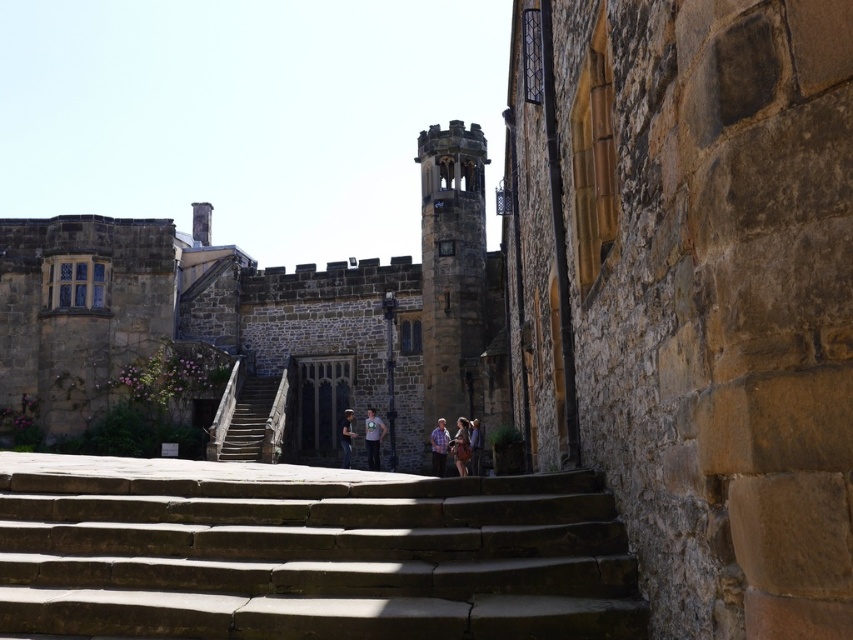
Question: Does brown stone tower at center appear on the right side of blue plaid shirt at center?

Choices:
 (A) no
 (B) yes

Answer: (B)

Question: Is light blue t-shirt at center bigger than denim skirt at center?

Choices:
 (A) no
 (B) yes

Answer: (B)

Question: Which of the following is the farthest from the observer?

Choices:
 (A) denim jacket at center
 (B) brown leather jacket at center
 (C) brown stone tower at center
 (D) brown stone stairs at center

Answer: (A)

Question: Which point is closer to the camera?

Choices:
 (A) brown stone tower at center
 (B) denim jacket at center

Answer: (A)

Question: Which of these objects is positioned farthest from the brown stone castle at center?

Choices:
 (A) brown leather jacket at center
 (B) brown stone stairs at center

Answer: (A)

Question: Is brown stone stairs at center closer to the viewer compared to brown leather jacket at center?

Choices:
 (A) no
 (B) yes

Answer: (B)